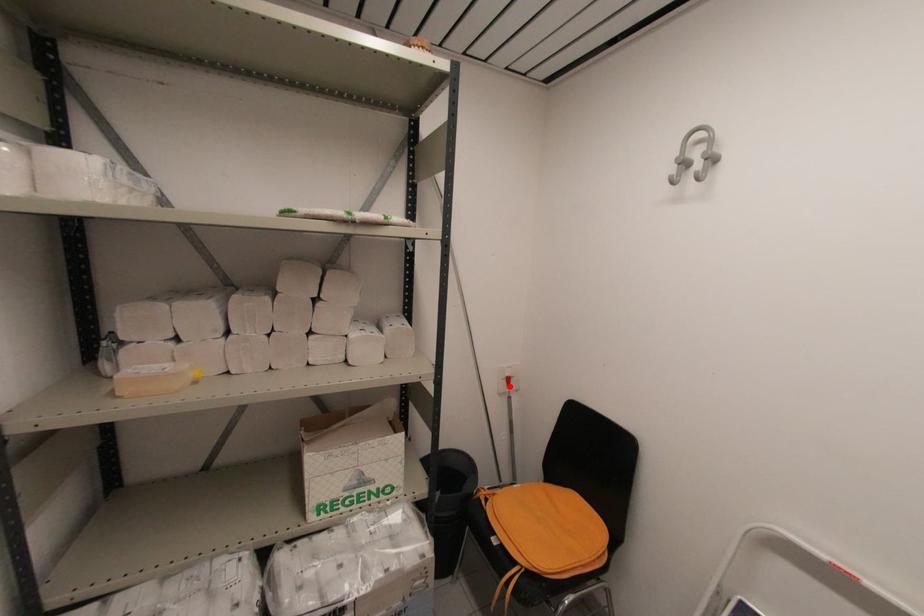
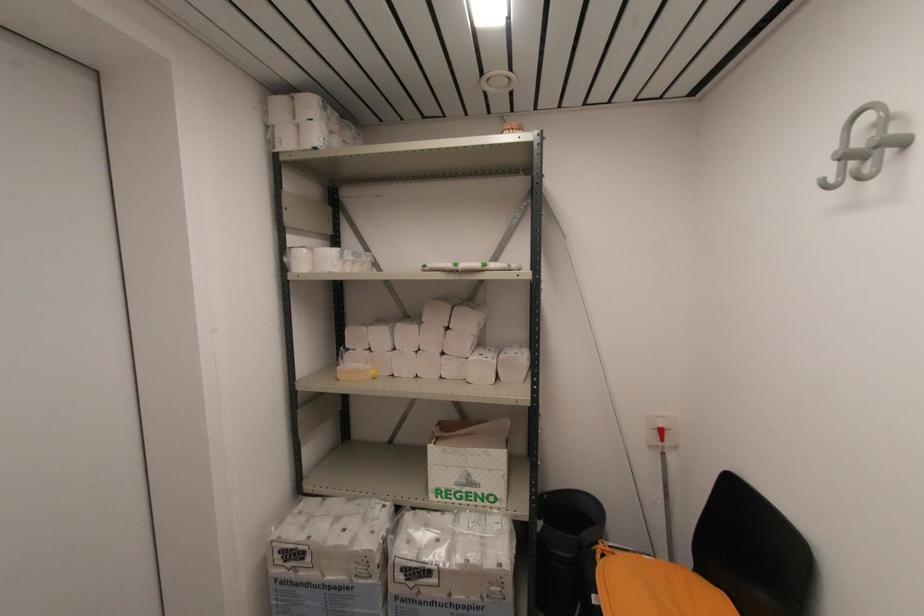
Locate, in the second image, the point that corresponds to the highlighted location in the first image.

(663, 439)